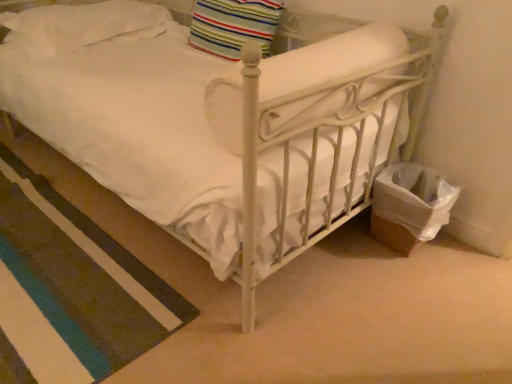
This screenshot has height=384, width=512. What do you see at coordinates (81, 25) in the screenshot?
I see `white soft pillow at upper left, which is counted as the second pillow, starting from the right` at bounding box center [81, 25].

The image size is (512, 384). Describe the element at coordinates (71, 289) in the screenshot. I see `white soft rug at lower left` at that location.

This screenshot has height=384, width=512. What do you see at coordinates (234, 25) in the screenshot? I see `striped fabric pillow at upper center, the 2th pillow positioned from the left` at bounding box center [234, 25].

The height and width of the screenshot is (384, 512). I want to click on white soft pillow at upper left, which is counted as the second pillow, starting from the right, so click(x=81, y=25).

Is white soft pillow at upper left, marked as the first pillow in a left-to-right arrangement, oriented towards striped fabric pillow at upper center, placed as the first pillow when sorted from right to left?

No.

Who is smaller, white soft pillow at upper left, which is counted as the second pillow, starting from the right, or striped fabric pillow at upper center, the 2th pillow positioned from the left?

striped fabric pillow at upper center, the 2th pillow positioned from the left, is smaller.

From a real-world perspective, which is physically below, white soft pillow at upper left, which is counted as the second pillow, starting from the right, or striped fabric pillow at upper center, the 2th pillow positioned from the left?

white soft pillow at upper left, which is counted as the second pillow, starting from the right, is physically lower.

From the image's perspective, is white soft pillow at upper left, which is counted as the second pillow, starting from the right, above or below striped fabric pillow at upper center, the 2th pillow positioned from the left?

Based on their image positions, white soft pillow at upper left, which is counted as the second pillow, starting from the right, is located above striped fabric pillow at upper center, the 2th pillow positioned from the left.

From a real-world perspective, which object stands above the other?

striped fabric pillow at upper center, the 2th pillow positioned from the left, from a real-world perspective.

Is striped fabric pillow at upper center, the 2th pillow positioned from the left, not within white soft rug at lower left?

That's correct, striped fabric pillow at upper center, the 2th pillow positioned from the left, is outside of white soft rug at lower left.

Image resolution: width=512 pixels, height=384 pixels. In order to click on strip in front of the striped fabric pillow at upper center, placed as the first pillow when sorted from right to left in this screenshot , I will do pyautogui.click(x=71, y=289).

Would you say white soft pillow at upper left, marked as the first pillow in a left-to-right arrangement, is inside or outside white soft rug at lower left?

white soft pillow at upper left, marked as the first pillow in a left-to-right arrangement, is not enclosed by white soft rug at lower left.

Is point (62, 20) positioned in front of point (108, 329)?

No, it is not.

Which object is positioned more to the left, white soft pillow at upper left, which is counted as the second pillow, starting from the right, or white soft rug at lower left?

From the viewer's perspective, white soft rug at lower left appears more on the left side.

Is striped fabric pillow at upper center, the 2th pillow positioned from the left, thinner than white soft pillow at upper left, marked as the first pillow in a left-to-right arrangement?

Yes, striped fabric pillow at upper center, the 2th pillow positioned from the left, is thinner than white soft pillow at upper left, marked as the first pillow in a left-to-right arrangement.

Is striped fabric pillow at upper center, the 2th pillow positioned from the left, positioned far away from white soft pillow at upper left, which is counted as the second pillow, starting from the right?

They are positioned close to each other.

Is striped fabric pillow at upper center, the 2th pillow positioned from the left, in front of or behind white soft pillow at upper left, which is counted as the second pillow, starting from the right, in the image?

striped fabric pillow at upper center, the 2th pillow positioned from the left, is positioned closer to the viewer than white soft pillow at upper left, which is counted as the second pillow, starting from the right.

Can you tell me how much striped fabric pillow at upper center, placed as the first pillow when sorted from right to left, and white soft pillow at upper left, which is counted as the second pillow, starting from the right, differ in facing direction?

striped fabric pillow at upper center, placed as the first pillow when sorted from right to left, and white soft pillow at upper left, which is counted as the second pillow, starting from the right, are facing 2.56 degrees away from each other.

Between white soft rug at lower left and white soft pillow at upper left, marked as the first pillow in a left-to-right arrangement, which one appears on the left side from the viewer's perspective?

Positioned to the left is white soft rug at lower left.

How many degrees apart are the facing directions of white soft rug at lower left and white soft pillow at upper left, which is counted as the second pillow, starting from the right?

There is a 87.4-degree angle between the facing directions of white soft rug at lower left and white soft pillow at upper left, which is counted as the second pillow, starting from the right.

Do you think white soft rug at lower left is within white soft pillow at upper left, marked as the first pillow in a left-to-right arrangement, or outside of it?

white soft rug at lower left is outside white soft pillow at upper left, marked as the first pillow in a left-to-right arrangement.

Considering the sizes of white soft rug at lower left and white soft pillow at upper left, marked as the first pillow in a left-to-right arrangement, in the image, is white soft rug at lower left bigger or smaller than white soft pillow at upper left, marked as the first pillow in a left-to-right arrangement,?

Considering their sizes, white soft rug at lower left takes up less space than white soft pillow at upper left, marked as the first pillow in a left-to-right arrangement.

Is point (117, 263) positioned in front of point (196, 11)?

That is True.

Is white soft rug at lower left wider than striped fabric pillow at upper center, the 2th pillow positioned from the left?

Indeed, white soft rug at lower left has a greater width compared to striped fabric pillow at upper center, the 2th pillow positioned from the left.

Which is more to the left, white soft rug at lower left or striped fabric pillow at upper center, placed as the first pillow when sorted from right to left?

white soft rug at lower left is more to the left.

The image size is (512, 384). I want to click on pillow below the striped fabric pillow at upper center, the 2th pillow positioned from the left (from a real-world perspective), so click(x=81, y=25).

Which pillow is the 1st one when counting from the back of the white soft rug at lower left? Please provide its 2D coordinates.

[(234, 25)]

Looking at this image, based on their spatial positions, is white soft pillow at upper left, which is counted as the second pillow, starting from the right, or striped fabric pillow at upper center, the 2th pillow positioned from the left, further from white soft rug at lower left?

The object further to white soft rug at lower left is striped fabric pillow at upper center, the 2th pillow positioned from the left.

Based on their spatial positions, is white soft pillow at upper left, which is counted as the second pillow, starting from the right, or white soft rug at lower left further from striped fabric pillow at upper center, placed as the first pillow when sorted from right to left?

Based on the image, white soft rug at lower left appears to be further to striped fabric pillow at upper center, placed as the first pillow when sorted from right to left.

Based on their spatial positions, is white soft rug at lower left or white soft pillow at upper left, marked as the first pillow in a left-to-right arrangement, further from striped fabric pillow at upper center, placed as the first pillow when sorted from right to left?

Among the two, white soft rug at lower left is located further to striped fabric pillow at upper center, placed as the first pillow when sorted from right to left.

Estimate the real-world distances between objects in this image. Which object is closer to white soft rug at lower left, striped fabric pillow at upper center, the 2th pillow positioned from the left, or white soft pillow at upper left, marked as the first pillow in a left-to-right arrangement?

Among the two, white soft pillow at upper left, marked as the first pillow in a left-to-right arrangement, is located nearer to white soft rug at lower left.

Which object lies further to the anchor point white soft pillow at upper left, which is counted as the second pillow, starting from the right, striped fabric pillow at upper center, the 2th pillow positioned from the left, or white soft rug at lower left?

Based on the image, white soft rug at lower left appears to be further to white soft pillow at upper left, which is counted as the second pillow, starting from the right.

From the image, which object appears to be farther from white soft pillow at upper left, marked as the first pillow in a left-to-right arrangement, white soft rug at lower left or striped fabric pillow at upper center, the 2th pillow positioned from the left?

white soft rug at lower left.

The height and width of the screenshot is (384, 512). Identify the location of pillow between white soft pillow at upper left, marked as the first pillow in a left-to-right arrangement, and white soft rug at lower left, in the vertical direction. (234, 25).